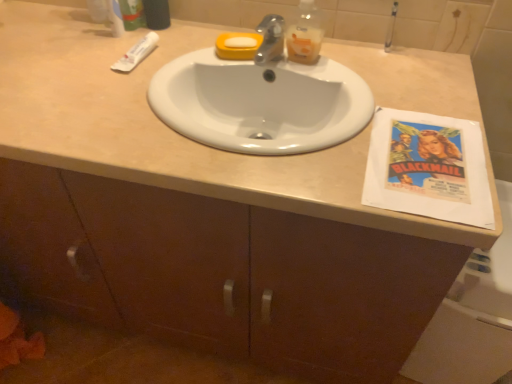
Question: From the image's perspective, is white glossy sink at center under translucent plastic bottle at upper center?

Choices:
 (A) no
 (B) yes

Answer: (B)

Question: Is white glossy sink at center thinner than translucent plastic bottle at upper center?

Choices:
 (A) no
 (B) yes

Answer: (A)

Question: Is white glossy sink at center closer to camera compared to translucent plastic bottle at upper center?

Choices:
 (A) yes
 (B) no

Answer: (A)

Question: Could translucent plastic bottle at upper center be considered to be inside white glossy sink at center?

Choices:
 (A) yes
 (B) no

Answer: (B)

Question: Does white glossy sink at center have a smaller size compared to translucent plastic bottle at upper center?

Choices:
 (A) yes
 (B) no

Answer: (B)

Question: Considering the relative sizes of white glossy sink at center and translucent plastic bottle at upper center in the image provided, is white glossy sink at center bigger than translucent plastic bottle at upper center?

Choices:
 (A) no
 (B) yes

Answer: (B)

Question: Is white matte tube at upper left thinner than white paper at right?

Choices:
 (A) no
 (B) yes

Answer: (B)

Question: Is white matte tube at upper left positioned far away from white paper at right?

Choices:
 (A) no
 (B) yes

Answer: (B)

Question: From a real-world perspective, is white matte tube at upper left on white paper at right?

Choices:
 (A) no
 (B) yes

Answer: (B)

Question: Considering the relative positions of white matte tube at upper left and white paper at right in the image provided, is white matte tube at upper left to the right of white paper at right from the viewer's perspective?

Choices:
 (A) no
 (B) yes

Answer: (A)

Question: Is white matte tube at upper left to the left of white paper at right from the viewer's perspective?

Choices:
 (A) yes
 (B) no

Answer: (A)

Question: Is white matte tube at upper left touching white paper at right?

Choices:
 (A) no
 (B) yes

Answer: (A)

Question: Is white matte tube at upper left wider than green matte toothpaste tube at upper left?

Choices:
 (A) no
 (B) yes

Answer: (B)